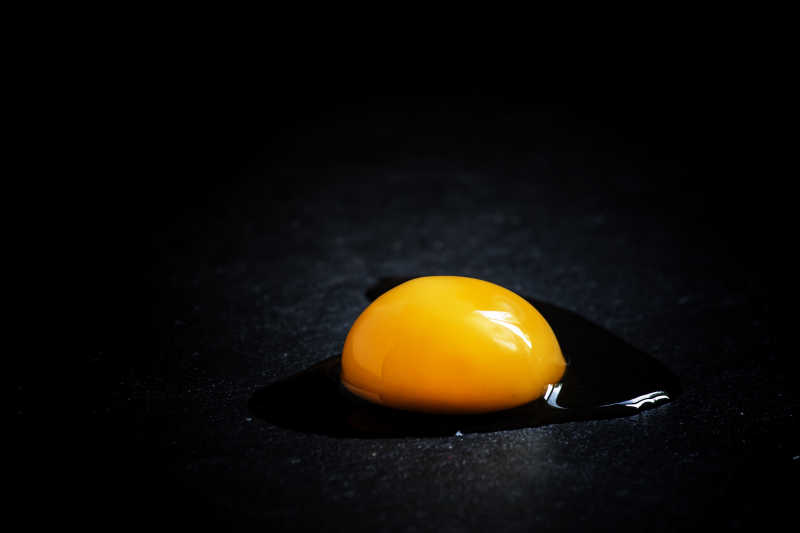
You are a GUI agent. You are given a task and a screenshot of the screen. Output one action in this format:
    pyautogui.click(x=<x>, y=<y>)
    Task: Click on the frying pan
    The image size is (800, 533).
    Given the screenshot: What is the action you would take?
    pyautogui.click(x=636, y=240)